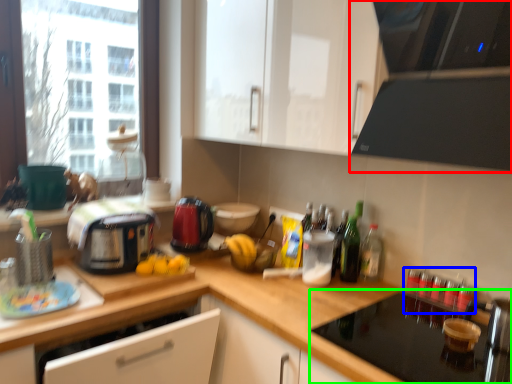
Question: Which object is positioned farthest from home appliance (highlighted by a red box)? Select from bottle (highlighted by a blue box) and appliance (highlighted by a green box).

Choices:
 (A) bottle
 (B) appliance

Answer: (A)